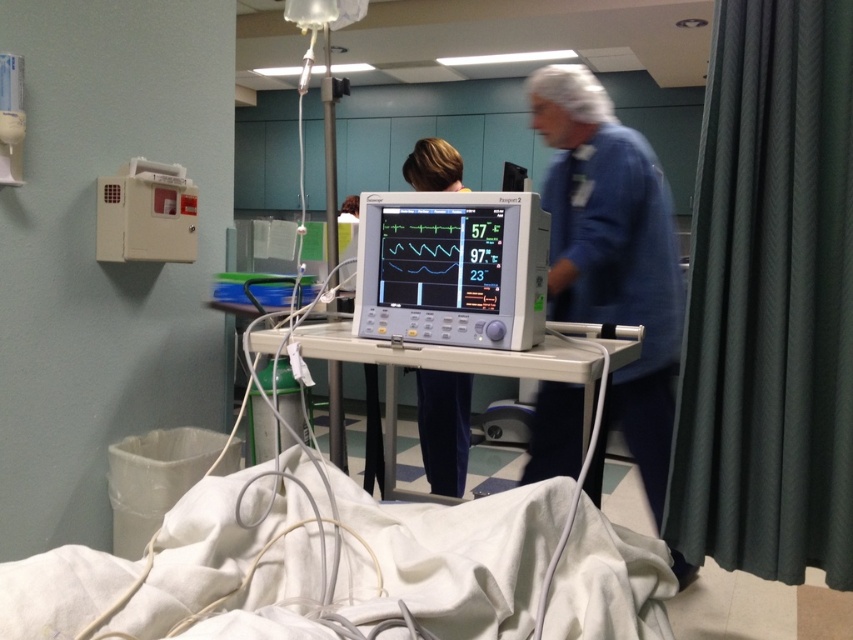
Question: Among these objects, which one is nearest to the camera?

Choices:
 (A) green textured curtain at right
 (B) white plastic cabinet at upper left
 (C) white plastic monitor at center

Answer: (C)

Question: Does white glossy monitor at center have a larger size compared to white plastic cabinet at upper left?

Choices:
 (A) no
 (B) yes

Answer: (A)

Question: Which point is farther to the camera?

Choices:
 (A) pyautogui.click(x=738, y=396)
 (B) pyautogui.click(x=479, y=307)
 (C) pyautogui.click(x=457, y=337)
 (D) pyautogui.click(x=503, y=605)

Answer: (A)

Question: Is white plastic monitor at center above white glossy monitor at center?

Choices:
 (A) yes
 (B) no

Answer: (B)

Question: Where is green textured curtain at right located in relation to white fabric bed at lower center in the image?

Choices:
 (A) below
 (B) above

Answer: (B)

Question: Which point is farther to the camera?

Choices:
 (A) white glossy monitor at center
 (B) white plastic monitor at center

Answer: (A)